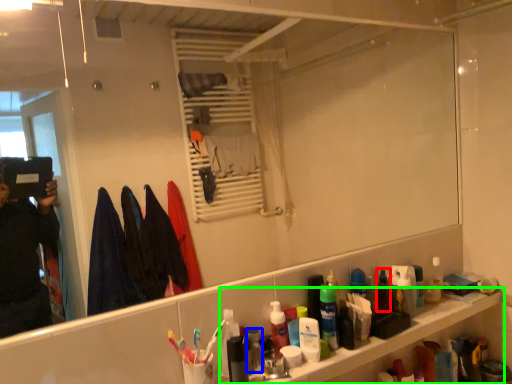
Question: Based on their relative distances, which object is farther from mouthwash (highlighted by a red box)? Choose from toiletry (highlighted by a blue box) and cabinet (highlighted by a green box).

Choices:
 (A) toiletry
 (B) cabinet

Answer: (A)